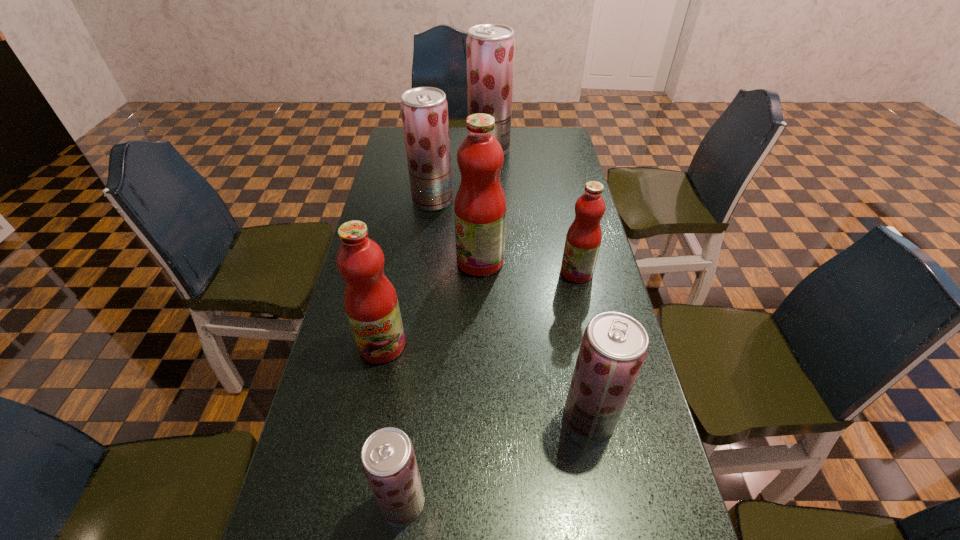
The width and height of the screenshot is (960, 540). I want to click on the farthest strawberry fruit juice, so click(x=490, y=48).

I want to click on the farthest object, so click(490, 48).

Identify the location of the biggest pink fruit juice. (480, 207).

In order to click on the sixth nearest fruit juice in this screenshot , I will do `click(424, 110)`.

The image size is (960, 540). Find the location of `the third nearest strawberry fruit juice`. the third nearest strawberry fruit juice is located at coordinates (424, 110).

You are a GUI agent. You are given a task and a screenshot of the screen. Output one action in this format:
    pyautogui.click(x=<x>, y=<y>)
    Task: Click on the fifth farthest object
    
    Given the screenshot: What is the action you would take?
    pyautogui.click(x=370, y=300)

What are the coordinates of `the nearest pink fruit juice` in the screenshot? It's located at (370, 300).

Locate an element on the screen. The width and height of the screenshot is (960, 540). the smallest pink fruit juice is located at coordinates (583, 239).

Image resolution: width=960 pixels, height=540 pixels. What are the coordinates of `the sixth farthest fruit juice` in the screenshot? It's located at (614, 346).

This screenshot has width=960, height=540. Find the location of `the second nearest strawberry fruit juice`. the second nearest strawberry fruit juice is located at coordinates (614, 346).